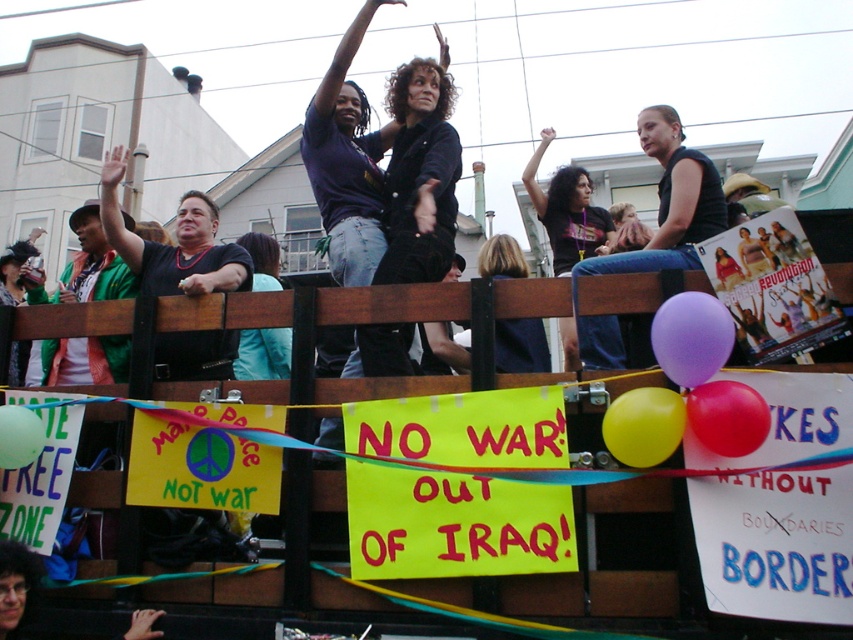
Question: Does purple rubber balloon at upper center appear on the right side of rubber balloon at center?

Choices:
 (A) no
 (B) yes

Answer: (A)

Question: Which point appears farthest from the camera in this image?

Choices:
 (A) (254, 330)
 (B) (706, 397)

Answer: (A)

Question: Which object is positioned closest to the rubber balloon at center?

Choices:
 (A) yellow rubber balloon at center
 (B) purple rubber balloon at upper center
 (C) green rubber balloon at lower left
 (D) teal fabric shirt at center

Answer: (A)

Question: Is purple rubber balloon at upper center above rubber balloon at center?

Choices:
 (A) no
 (B) yes

Answer: (B)

Question: Which is farther from the teal fabric shirt at center?

Choices:
 (A) purple rubber balloon at upper center
 (B) yellow rubber balloon at center
 (C) rubber balloon at center
 (D) green rubber balloon at lower left

Answer: (C)

Question: Where is yellow rubber balloon at center located in relation to rubber balloon at center in the image?

Choices:
 (A) left
 (B) right

Answer: (A)